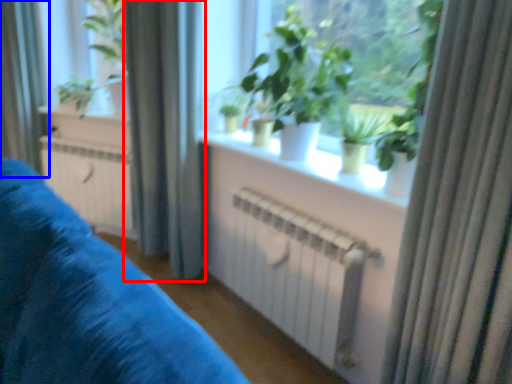
Question: Which object is further to the camera taking this photo, curtain (highlighted by a red box) or curtain (highlighted by a blue box)?

Choices:
 (A) curtain
 (B) curtain

Answer: (B)